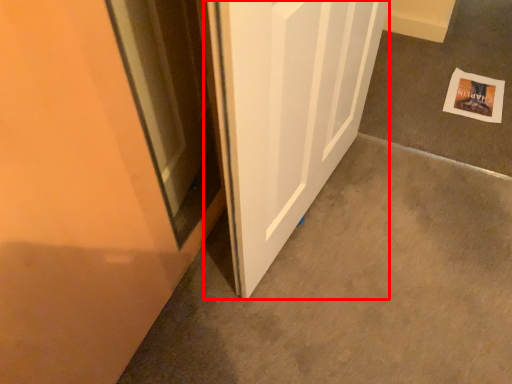
Question: Considering the relative positions of door (annotated by the red box) and postcard in the image provided, where is door (annotated by the red box) located with respect to the staircase?

Choices:
 (A) left
 (B) right

Answer: (A)